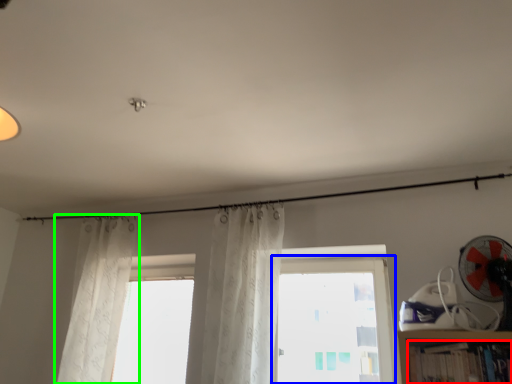
Question: Which is farther away from book (highlighted by a red box)? window (highlighted by a blue box) or curtain (highlighted by a green box)?

Choices:
 (A) window
 (B) curtain

Answer: (B)